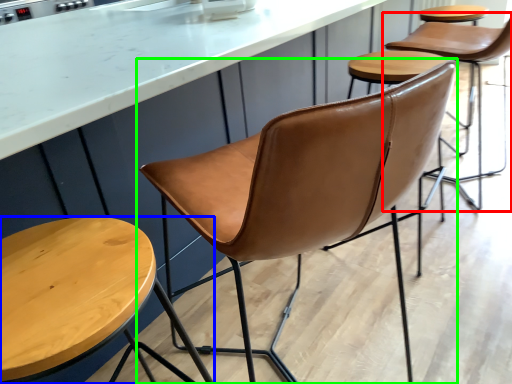
Question: Estimate the real-world distances between objects in this image. Which object is closer to chair (highlighted by a red box), stool (highlighted by a blue box) or chair (highlighted by a green box)?

Choices:
 (A) stool
 (B) chair

Answer: (B)